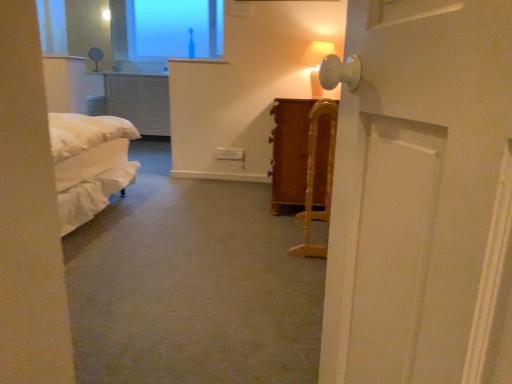
Describe the element at coordinates (166, 29) in the screenshot. Image resolution: width=512 pixels, height=384 pixels. I see `transparent glass window at upper center` at that location.

The image size is (512, 384). Identify the location of matte white table lamp at upper center, the second table lamp from the front. (95, 56).

Between matte white table lamp at upper right, placed as the second table lamp when sorted from left to right, and transparent glass window at upper center, which one has smaller width?

Thinner between the two is matte white table lamp at upper right, placed as the second table lamp when sorted from left to right.

Is matte white table lamp at upper right, placed as the first table lamp when sorted from front to back, taller or shorter than transparent glass window at upper center?

In the image, matte white table lamp at upper right, placed as the first table lamp when sorted from front to back, appears to be shorter than transparent glass window at upper center.

Is matte white table lamp at upper right, placed as the second table lamp when sorted from left to right, turned away from transparent glass window at upper center?

No, matte white table lamp at upper right, placed as the second table lamp when sorted from left to right, is not facing away from transparent glass window at upper center.

From the image's perspective, which is below, matte white table lamp at upper right, which appears as the 2th table lamp when viewed from the top, or transparent glass window at upper center?

matte white table lamp at upper right, which appears as the 2th table lamp when viewed from the top, from the image's perspective.

From a real-world perspective, which is physically above, matte white table lamp at upper center, which ranks as the 1th table lamp in back-to-front order, or matte white table lamp at upper right, which appears as the 2th table lamp when viewed from the top?

matte white table lamp at upper center, which ranks as the 1th table lamp in back-to-front order, from a real-world perspective.

Between matte white table lamp at upper center, placed as the second table lamp when sorted from bottom to top, and matte white table lamp at upper right, which is the second table lamp in back-to-front order, which one has larger size?

Bigger between the two is matte white table lamp at upper right, which is the second table lamp in back-to-front order.

You are a GUI agent. You are given a task and a screenshot of the screen. Output one action in this format:
    pyautogui.click(x=<x>, y=<y>)
    Task: Click on the table lamp that appears above the matte white table lamp at upper right, which appears as the 2th table lamp when viewed from the top (from the image's perspective)
    The width and height of the screenshot is (512, 384).
    Given the screenshot: What is the action you would take?
    pyautogui.click(x=95, y=56)

Does matte white table lamp at upper center, marked as the first table lamp in a top-to-bottom arrangement, touch matte white table lamp at upper right, which is the second table lamp in back-to-front order?

They are not placed beside each other.

Looking at this image, does wooden cane at center lie behind matte white table lamp at upper right, which is the second table lamp in back-to-front order?

No, wooden cane at center is closer to the camera.

Is wooden cane at center looking in the opposite direction of matte white table lamp at upper right, which is the second table lamp in back-to-front order?

No.

Can you tell me how much wooden cane at center and matte white table lamp at upper right, positioned as the 1th table lamp in bottom-to-top order, differ in facing direction?

The angle between the facing direction of wooden cane at center and the facing direction of matte white table lamp at upper right, positioned as the 1th table lamp in bottom-to-top order, is 3.84 degrees.

Which table lamp is the 2nd one when counting from the back of the wooden cane at center? Please provide its 2D coordinates.

[(95, 56)]

Considering the positions of objects matte white table lamp at upper center, the second table lamp viewed from the right, and wooden cane at center in the image provided, who is behind, matte white table lamp at upper center, the second table lamp viewed from the right, or wooden cane at center?

Positioned behind is matte white table lamp at upper center, the second table lamp viewed from the right.

From a real-world perspective, does matte white table lamp at upper center, placed as the second table lamp when sorted from bottom to top, stand above wooden cane at center?

Yes, from a real-world perspective, matte white table lamp at upper center, placed as the second table lamp when sorted from bottom to top, is over wooden cane at center

Does point (102, 54) appear closer or farther from the camera than point (305, 217)?

Clearly, point (102, 54) is more distant from the camera than point (305, 217).

Considering the positions of point (192, 34) and point (320, 91), is point (192, 34) closer or farther from the camera than point (320, 91)?

Point (192, 34) is farther from the camera than point (320, 91).

Does transparent glass window at upper center lie in front of matte white table lamp at upper right, which appears as the 2th table lamp when viewed from the top?

No, transparent glass window at upper center is behind matte white table lamp at upper right, which appears as the 2th table lamp when viewed from the top.

Could matte white table lamp at upper right, which appears as the 2th table lamp when viewed from the top, be considered to be inside transparent glass window at upper center?

That's incorrect, matte white table lamp at upper right, which appears as the 2th table lamp when viewed from the top, is not inside transparent glass window at upper center.

Is transparent glass window at upper center bigger than matte white table lamp at upper right, positioned as the 1th table lamp in bottom-to-top order?

Yes.

Is matte white table lamp at upper center, which ranks as the 1th table lamp in back-to-front order, inside or outside of transparent glass window at upper center?

matte white table lamp at upper center, which ranks as the 1th table lamp in back-to-front order, is located beyond the bounds of transparent glass window at upper center.

Which table lamp is the 1st one when counting from the front of the transparent glass window at upper center? Please provide its 2D coordinates.

[(95, 56)]

Is matte white table lamp at upper center, placed as the second table lamp when sorted from bottom to top, further to the viewer compared to transparent glass window at upper center?

No, matte white table lamp at upper center, placed as the second table lamp when sorted from bottom to top, is closer to the camera.

Which is closer, (97, 69) or (170, 33)?

Point (97, 69) appears to be closer to the viewer than point (170, 33).

Who is taller, wooden cane at center or matte white table lamp at upper center, the second table lamp from the front?

wooden cane at center.

Consider the image. Can you confirm if wooden cane at center is positioned to the right of matte white table lamp at upper center, placed as the second table lamp when sorted from bottom to top?

Indeed, wooden cane at center is positioned on the right side of matte white table lamp at upper center, placed as the second table lamp when sorted from bottom to top.

From a real-world perspective, which object rests below the other?

From a 3D spatial view, wooden cane at center is below.

Is wooden cane at center next to matte white table lamp at upper center, which ranks as the 1th table lamp in back-to-front order, and touching it?

No.

Where is `window on the left of matte white table lamp at upper right, placed as the second table lamp when sorted from left to right`? The height and width of the screenshot is (384, 512). window on the left of matte white table lamp at upper right, placed as the second table lamp when sorted from left to right is located at coordinates (166, 29).

Where is `table lamp above the matte white table lamp at upper right, the first table lamp in the right-to-left sequence (from the image's perspective)`? table lamp above the matte white table lamp at upper right, the first table lamp in the right-to-left sequence (from the image's perspective) is located at coordinates (95, 56).

Looking at the image, which one is located closer to matte white table lamp at upper center, marked as the first table lamp in a left-to-right arrangement, transparent glass window at upper center or matte white table lamp at upper right, the first table lamp in the right-to-left sequence?

Based on the image, transparent glass window at upper center appears to be nearer to matte white table lamp at upper center, marked as the first table lamp in a left-to-right arrangement.

Considering their positions, is wooden cane at center positioned further to matte white table lamp at upper right, the first table lamp in the right-to-left sequence, than transparent glass window at upper center?

Based on the image, transparent glass window at upper center appears to be further to matte white table lamp at upper right, the first table lamp in the right-to-left sequence.

Based on their spatial positions, is transparent glass window at upper center or matte white table lamp at upper right, which is the second table lamp in back-to-front order, further from wooden cane at center?

Based on the image, transparent glass window at upper center appears to be further to wooden cane at center.

Looking at the image, which one is located closer to matte white table lamp at upper center, the second table lamp viewed from the right, matte white table lamp at upper right, placed as the second table lamp when sorted from left to right, or transparent glass window at upper center?

Based on the image, transparent glass window at upper center appears to be nearer to matte white table lamp at upper center, the second table lamp viewed from the right.

Which object lies further to the anchor point matte white table lamp at upper center, marked as the first table lamp in a left-to-right arrangement, wooden cane at center or transparent glass window at upper center?

wooden cane at center lies further to matte white table lamp at upper center, marked as the first table lamp in a left-to-right arrangement, than the other object.

When comparing their distances from matte white table lamp at upper right, the first table lamp in the right-to-left sequence, does matte white table lamp at upper center, the second table lamp viewed from the right, or wooden cane at center seem further?

Among the two, matte white table lamp at upper center, the second table lamp viewed from the right, is located further to matte white table lamp at upper right, the first table lamp in the right-to-left sequence.

When comparing their distances from wooden cane at center, does matte white table lamp at upper right, which is the second table lamp in back-to-front order, or matte white table lamp at upper center, which ranks as the 1th table lamp in back-to-front order, seem further?

matte white table lamp at upper center, which ranks as the 1th table lamp in back-to-front order.

Based on their spatial positions, is wooden cane at center or matte white table lamp at upper center, marked as the first table lamp in a top-to-bottom arrangement, further from matte white table lamp at upper right, placed as the first table lamp when sorted from front to back?

matte white table lamp at upper center, marked as the first table lamp in a top-to-bottom arrangement, is further to matte white table lamp at upper right, placed as the first table lamp when sorted from front to back.

You are a GUI agent. You are given a task and a screenshot of the screen. Output one action in this format:
    pyautogui.click(x=<x>, y=<y>)
    Task: Click on the table lamp located between wooden cane at center and matte white table lamp at upper center, the second table lamp from the front, in the depth direction
    This screenshot has height=384, width=512.
    Given the screenshot: What is the action you would take?
    pyautogui.click(x=317, y=52)

Identify the location of table lamp located between matte white table lamp at upper right, positioned as the 1th table lamp in bottom-to-top order, and transparent glass window at upper center in the depth direction. This screenshot has height=384, width=512. coord(95,56).